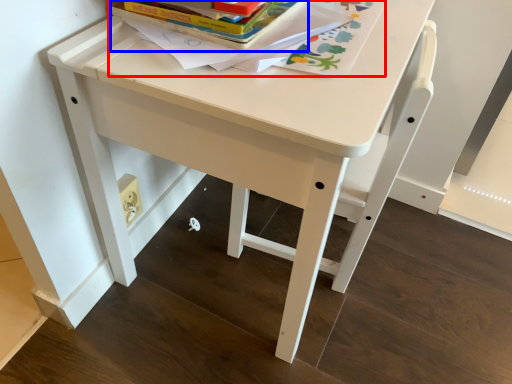
Question: Which object appears farthest to the camera in this image, book (highlighted by a red box) or paperback book (highlighted by a blue box)?

Choices:
 (A) book
 (B) paperback book

Answer: (B)